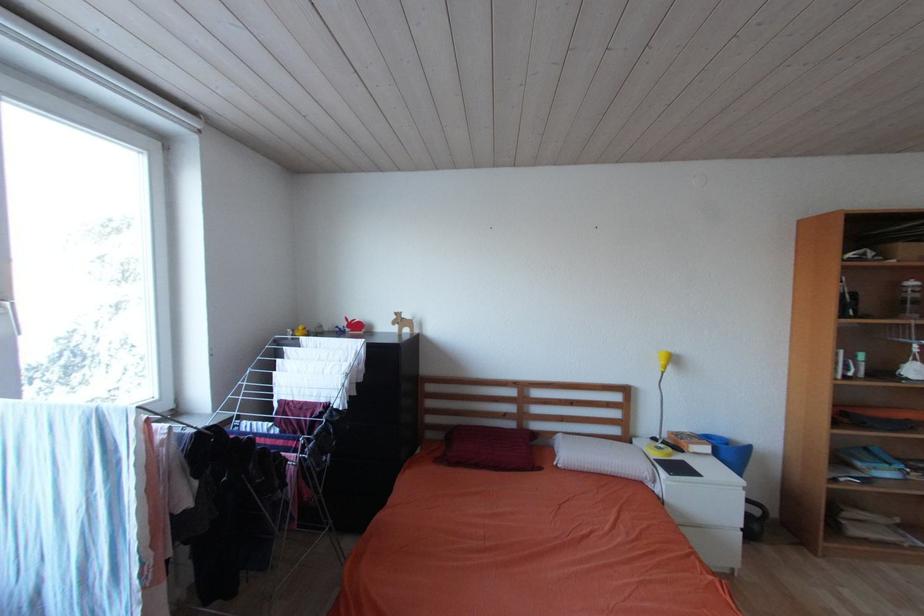
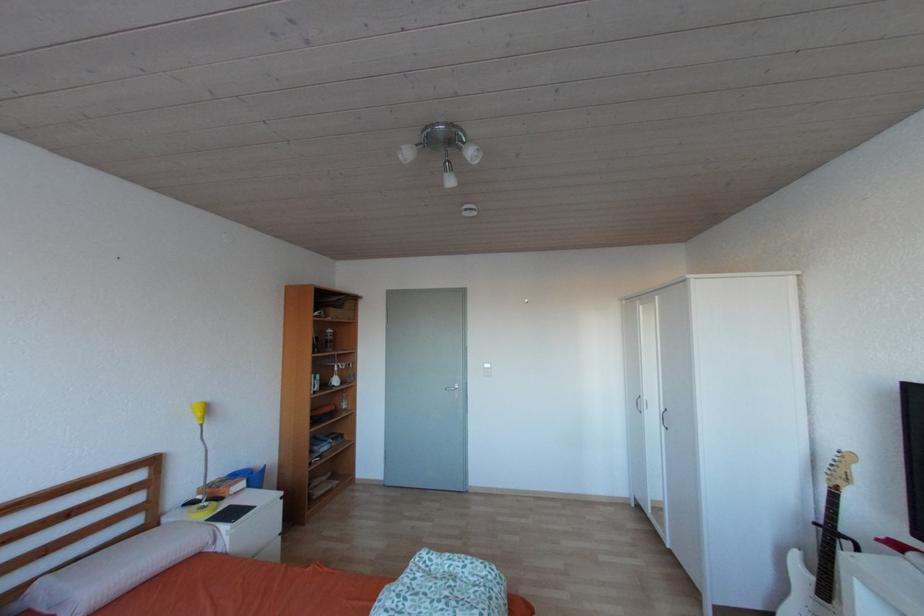
Question: Based on the continuous images, in which direction is the camera rotating? Reply with the corresponding letter.

Choices:
 (A) Left
 (B) Right
 (C) Up
 (D) Down

Answer: (B)